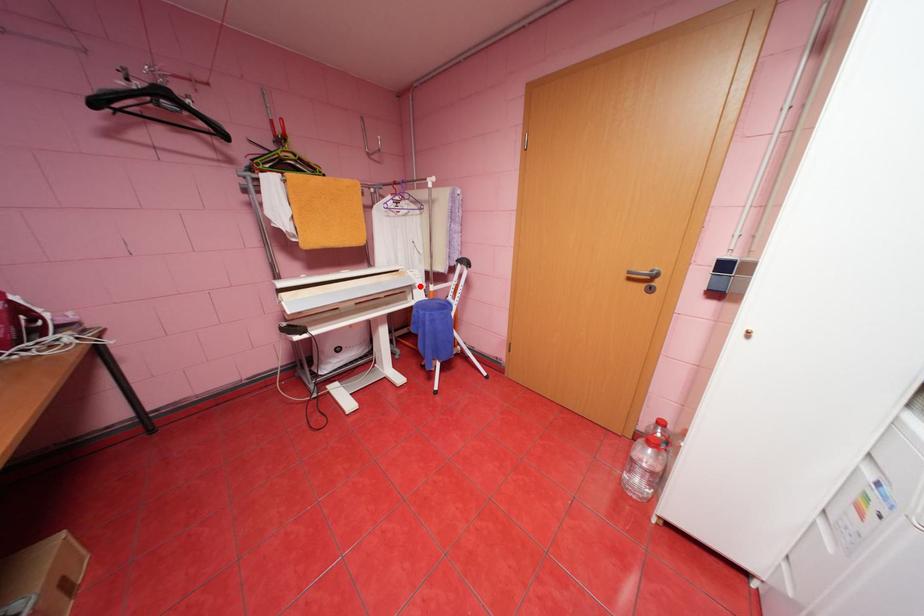
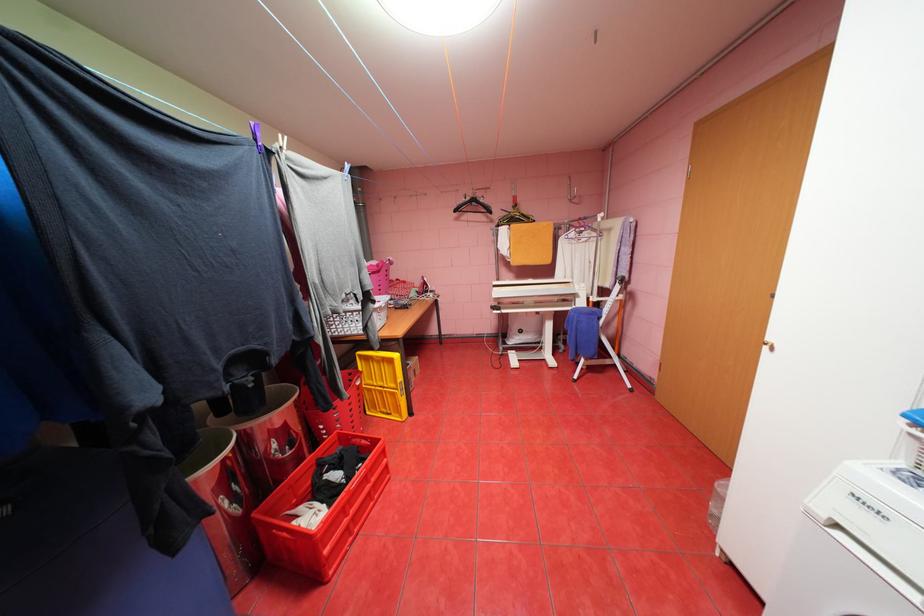
The point at the highlighted location is marked in the first image. Where is the corresponding point in the second image?

(584, 294)